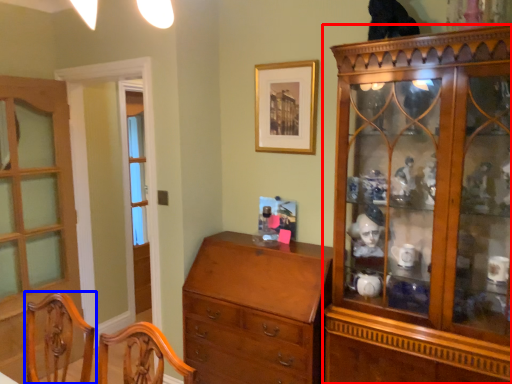
Question: Which object is closer to the camera taking this photo, cabinetry (highlighted by a red box) or chair (highlighted by a blue box)?

Choices:
 (A) cabinetry
 (B) chair

Answer: (B)